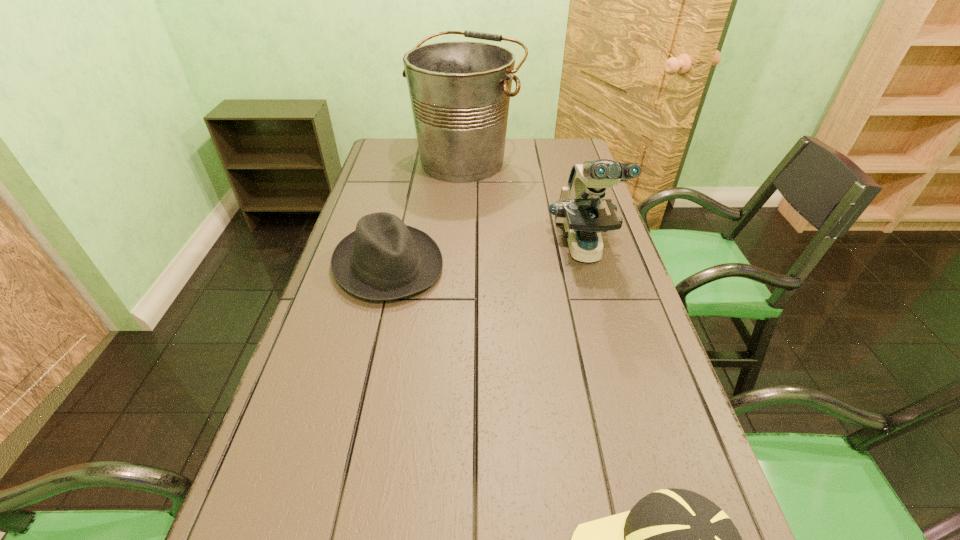
Choose which object is the second nearest neighbor to the shortest object. Please provide its 2D coordinates. Your answer should be formatted as a tuple, i.e. [(x, y)], where the tuple contains the x and y coordinates of a point satisfying the conditions above.

[(581, 209)]

Choose which object is the nearest neighbor to the tallest object. Please provide its 2D coordinates. Your answer should be formatted as a tuple, i.e. [(x, y)], where the tuple contains the x and y coordinates of a point satisfying the conditions above.

[(581, 209)]